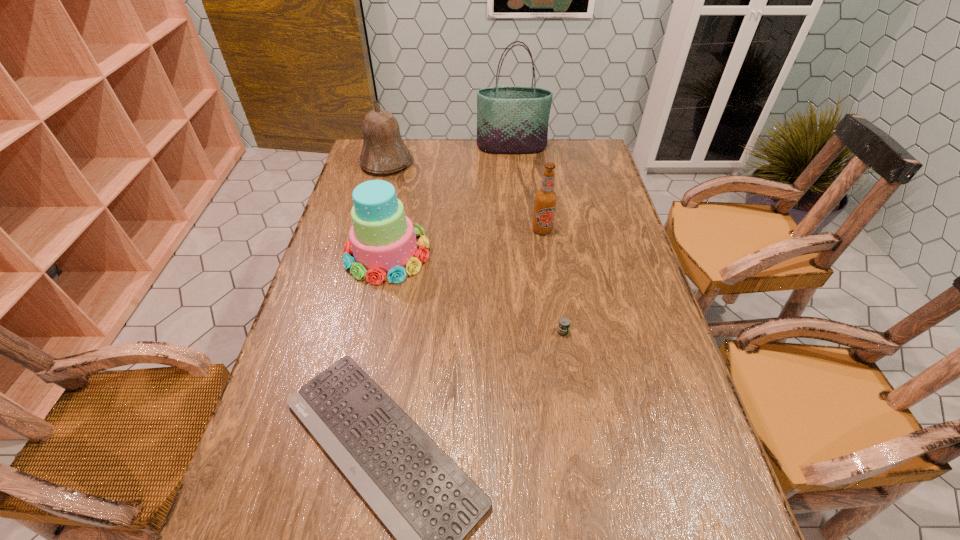
This screenshot has height=540, width=960. Find the location of `free space between the beer bottle and the beer can`. free space between the beer bottle and the beer can is located at coordinates (552, 281).

What are the coordinates of `free point between the bell and the tallest object` in the screenshot? It's located at (449, 155).

Locate an element on the screen. This screenshot has height=540, width=960. free space between the bell and the second shortest object is located at coordinates (474, 247).

In order to click on free spot between the fifth tallest object and the tallest object in this screenshot , I will do `click(538, 240)`.

Where is `vacant area between the tote bag and the beer bottle`? The width and height of the screenshot is (960, 540). vacant area between the tote bag and the beer bottle is located at coordinates (527, 188).

The height and width of the screenshot is (540, 960). Find the location of `free space between the second shortest object and the bell`. free space between the second shortest object and the bell is located at coordinates (474, 247).

You are a GUI agent. You are given a task and a screenshot of the screen. Output one action in this format:
    pyautogui.click(x=<x>, y=<y>)
    Task: Click on the vacant area that lies between the tote bag and the cake
    
    Given the screenshot: What is the action you would take?
    pyautogui.click(x=449, y=200)

At what (x,y) coordinates should I click in order to perform the action: click on free space between the cake and the beer bottle. Please return your answer as a coordinate pair (x, y). Looking at the image, I should click on (465, 241).

This screenshot has height=540, width=960. I want to click on object that can be found as the fifth closest to the fifth tallest object, so click(510, 119).

Choose which object is the fourth nearest neighbor to the beer can. Please provide its 2D coordinates. Your answer should be formatted as a tuple, i.e. [(x, y)], where the tuple contains the x and y coordinates of a point satisfying the conditions above.

[(384, 151)]